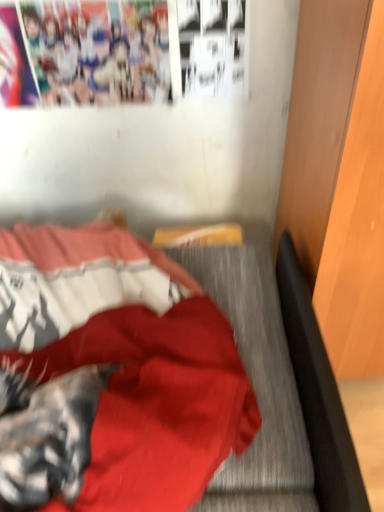
What do you see at coordinates (125, 364) in the screenshot? I see `textured fabric bedspread at lower left` at bounding box center [125, 364].

The height and width of the screenshot is (512, 384). Identify the location of textured fabric bedspread at lower left. (125, 364).

At what (x,y) coordinates should I click in order to perform the action: click on textured fabric bedspread at lower left. Please return your answer as a coordinate pair (x, y). This screenshot has width=384, height=512. Looking at the image, I should click on (125, 364).